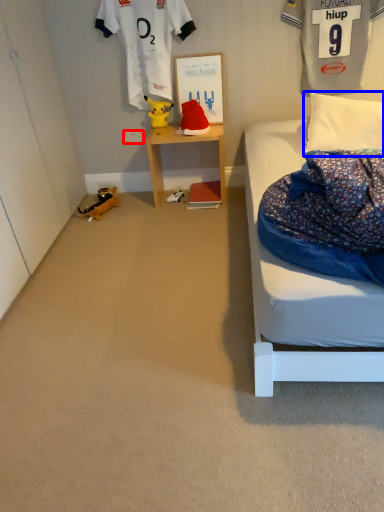
Question: Which object appears farthest to the camera in this image, power outlet (highlighted by a red box) or pillow (highlighted by a blue box)?

Choices:
 (A) power outlet
 (B) pillow

Answer: (A)